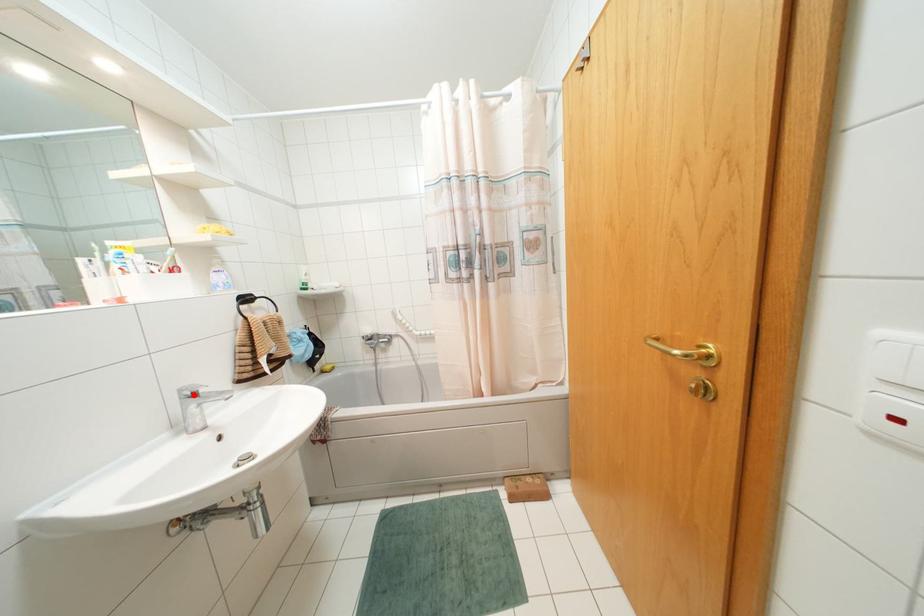
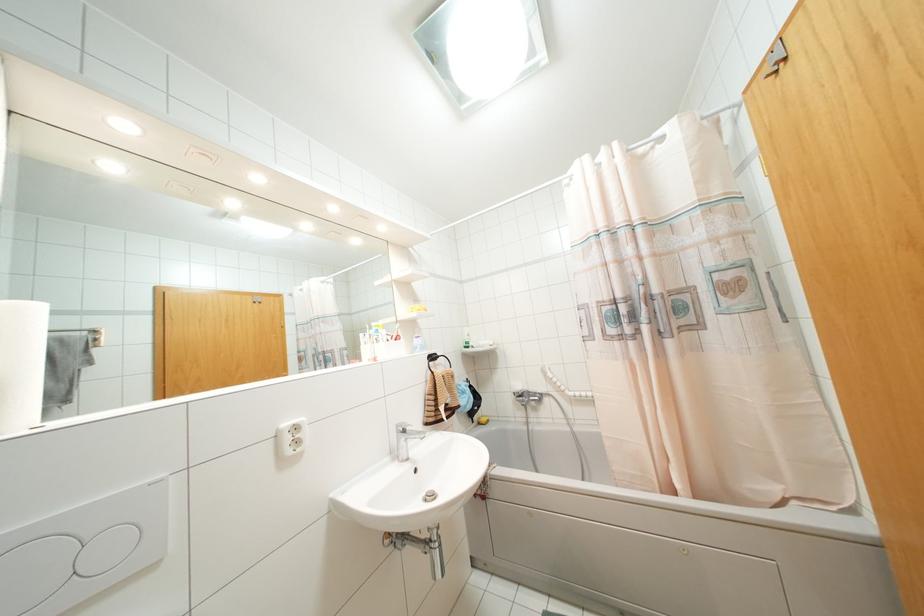
Where in the second image is the point corresponding to the highlighted location from the first image?

(404, 431)